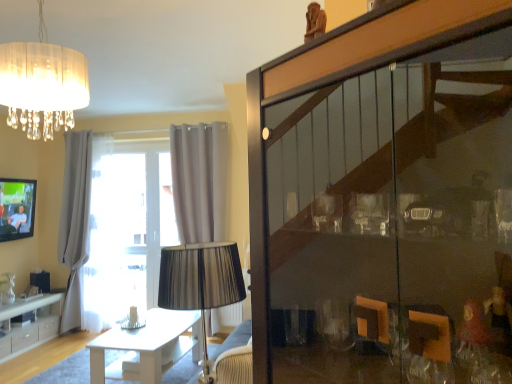
Measure the distance between point (165, 333) and camera.

Point (165, 333) is 3.50 meters from camera.

Measure the distance between point (19, 93) and camera.

6.54 feet.

Image resolution: width=512 pixels, height=384 pixels. Find the location of `white glossy cabinet at lower left`. white glossy cabinet at lower left is located at coordinates (30, 324).

Which of these two, white sheer curtain at left, marked as the 2th curtain in a right-to-left arrangement, or white pleated curtain at center, marked as the 2th curtain in a left-to-right arrangement, stands shorter?

A: Standing shorter between the two is white sheer curtain at left, marked as the 2th curtain in a right-to-left arrangement.

Does white sheer curtain at left, the 1th curtain in the left-to-right sequence, appear on the left side of white pleated curtain at center, acting as the first curtain starting from the right?

Yes, white sheer curtain at left, the 1th curtain in the left-to-right sequence, is to the left of white pleated curtain at center, acting as the first curtain starting from the right.

From the image's perspective, is white sheer curtain at left, marked as the 2th curtain in a right-to-left arrangement, beneath white pleated curtain at center, marked as the 2th curtain in a left-to-right arrangement?

Yes, from the image's perspective, white sheer curtain at left, marked as the 2th curtain in a right-to-left arrangement, is beneath white pleated curtain at center, marked as the 2th curtain in a left-to-right arrangement.

Is white sheer curtain at left, marked as the 2th curtain in a right-to-left arrangement, further to camera compared to white pleated curtain at center, acting as the first curtain starting from the right?

Yes, it is.

Based on the photo, do you think white glossy table at center is within white sheer curtain at left, the 1th curtain in the left-to-right sequence, or outside of it?

white glossy table at center cannot be found inside white sheer curtain at left, the 1th curtain in the left-to-right sequence.

In the image, is white glossy table at center positioned in front of or behind white sheer curtain at left, marked as the 2th curtain in a right-to-left arrangement?

Visually, white glossy table at center is located in front of white sheer curtain at left, marked as the 2th curtain in a right-to-left arrangement.

Is white glossy table at center taller than white sheer curtain at left, marked as the 2th curtain in a right-to-left arrangement?

No.

Looking at this image, considering the relative sizes of white glossy table at center and white sheer curtain at left, the 1th curtain in the left-to-right sequence, in the image provided, is white glossy table at center smaller than white sheer curtain at left, the 1th curtain in the left-to-right sequence,?

Indeed, white glossy table at center has a smaller size compared to white sheer curtain at left, the 1th curtain in the left-to-right sequence.

Is white glossy cabinet at lower left completely or partially outside of white sheer curtain at left, the 1th curtain in the left-to-right sequence?

Yes.

Who is shorter, white glossy cabinet at lower left or white sheer curtain at left, the 1th curtain in the left-to-right sequence?

white glossy cabinet at lower left is shorter.

In the image, is white glossy cabinet at lower left positioned in front of or behind white sheer curtain at left, the 1th curtain in the left-to-right sequence?

white glossy cabinet at lower left is in front of white sheer curtain at left, the 1th curtain in the left-to-right sequence.

Which is less distant, (10, 332) or (75, 252)?

Point (10, 332)

From their relative heights in the image, would you say white sheer curtain at left, marked as the 2th curtain in a right-to-left arrangement, is taller or shorter than translucent fabric chandelier at upper left?

Clearly, white sheer curtain at left, marked as the 2th curtain in a right-to-left arrangement, is taller compared to translucent fabric chandelier at upper left.

Which is further, (91, 325) or (64, 105)?

Positioned behind is point (91, 325).

Consider the image. From a real-world perspective, is white sheer curtain at left, the 1th curtain in the left-to-right sequence, physically located above or below translucent fabric chandelier at upper left?

In terms of real-world spatial position, white sheer curtain at left, the 1th curtain in the left-to-right sequence, is below translucent fabric chandelier at upper left.

Is white pleated curtain at center, marked as the 2th curtain in a left-to-right arrangement, oriented towards white sheer curtain at left, the 1th curtain in the left-to-right sequence?

No, white pleated curtain at center, marked as the 2th curtain in a left-to-right arrangement, is not oriented towards white sheer curtain at left, the 1th curtain in the left-to-right sequence.

What are the coordinates of `curtain that is behind the white pleated curtain at center, marked as the 2th curtain in a left-to-right arrangement` in the screenshot? It's located at (78, 224).

In terms of size, does white pleated curtain at center, marked as the 2th curtain in a left-to-right arrangement, appear bigger or smaller than white sheer curtain at left, marked as the 2th curtain in a right-to-left arrangement?

white pleated curtain at center, marked as the 2th curtain in a left-to-right arrangement, is bigger than white sheer curtain at left, marked as the 2th curtain in a right-to-left arrangement.

Is clear glass vase at lower left bigger than translucent fabric chandelier at upper left?

No.

Locate an element on the screen. lamp above the clear glass vase at lower left (from the image's perspective) is located at coordinates (42, 84).

From the image's perspective, is clear glass vase at lower left located beneath translucent fabric chandelier at upper left?

Yes.

Is clear glass vase at lower left aimed at translucent fabric chandelier at upper left?

No, clear glass vase at lower left is not oriented towards translucent fabric chandelier at upper left.

Is white glossy table at center not near translucent fabric chandelier at upper left?

Yes, white glossy table at center is far from translucent fabric chandelier at upper left.

From the image's perspective, is white glossy table at center beneath translucent fabric chandelier at upper left?

Correct, white glossy table at center appears lower than translucent fabric chandelier at upper left in the image.

Who is shorter, white glossy table at center or translucent fabric chandelier at upper left?

Standing shorter between the two is white glossy table at center.

How different are the orientations of white glossy table at center and translucent fabric chandelier at upper left in degrees?

They differ by 3.58 degrees in their facing directions.

Image resolution: width=512 pixels, height=384 pixels. In order to click on curtain below the white sheer curtain at left, the 1th curtain in the left-to-right sequence (from a real-world perspective) in this screenshot , I will do `click(200, 180)`.

Which curtain is the 2nd one when counting from the back of the white glossy table at center? Please provide its 2D coordinates.

[(78, 224)]

From the image, which object appears to be farther from matte black tv at left, white glossy table at center or white pleated curtain at center, acting as the first curtain starting from the right?

white glossy table at center lies further to matte black tv at left than the other object.

From the image, which object appears to be farther from white glossy cabinet at lower left, white glossy table at center or translucent fabric chandelier at upper left?

Among the two, translucent fabric chandelier at upper left is located further to white glossy cabinet at lower left.

Looking at this image, estimate the real-world distances between objects in this image. Which object is further from translucent fabric chandelier at upper left, matte black tv at left or white sheer curtain at left, marked as the 2th curtain in a right-to-left arrangement?

Based on the image, white sheer curtain at left, marked as the 2th curtain in a right-to-left arrangement, appears to be further to translucent fabric chandelier at upper left.

From the image, which object appears to be farther from white pleated curtain at center, marked as the 2th curtain in a left-to-right arrangement, white glossy table at center or matte black tv at left?

The object further to white pleated curtain at center, marked as the 2th curtain in a left-to-right arrangement, is matte black tv at left.

Which object lies nearer to the anchor point translucent fabric chandelier at upper left, white pleated curtain at center, acting as the first curtain starting from the right, or clear glass vase at lower left?

The object closer to translucent fabric chandelier at upper left is white pleated curtain at center, acting as the first curtain starting from the right.

Which object lies further to the anchor point translucent fabric chandelier at upper left, white sheer curtain at left, the 1th curtain in the left-to-right sequence, or matte black tv at left?

white sheer curtain at left, the 1th curtain in the left-to-right sequence.

When comparing their distances from white glossy table at center, does white pleated curtain at center, marked as the 2th curtain in a left-to-right arrangement, or translucent fabric chandelier at upper left seem further?

The object further to white glossy table at center is translucent fabric chandelier at upper left.

Considering their positions, is white glossy table at center positioned closer to white pleated curtain at center, acting as the first curtain starting from the right, than white glossy cabinet at lower left?

The object closer to white pleated curtain at center, acting as the first curtain starting from the right, is white glossy table at center.

Locate an element on the screen. The image size is (512, 384). cabinetry located between translucent fabric chandelier at upper left and white pleated curtain at center, marked as the 2th curtain in a left-to-right arrangement, in the depth direction is located at coordinates (30, 324).

At what (x,y) coordinates should I click in order to perform the action: click on glass vase located between translucent fabric chandelier at upper left and white sheer curtain at left, the 1th curtain in the left-to-right sequence, in the depth direction. Please return your answer as a coordinate pair (x, y). The width and height of the screenshot is (512, 384). Looking at the image, I should click on (7, 288).

The image size is (512, 384). I want to click on table between clear glass vase at lower left and white pleated curtain at center, acting as the first curtain starting from the right, so click(x=147, y=347).

This screenshot has height=384, width=512. In order to click on table between matte black tv at left and white pleated curtain at center, acting as the first curtain starting from the right, in the horizontal direction in this screenshot , I will do `click(147, 347)`.